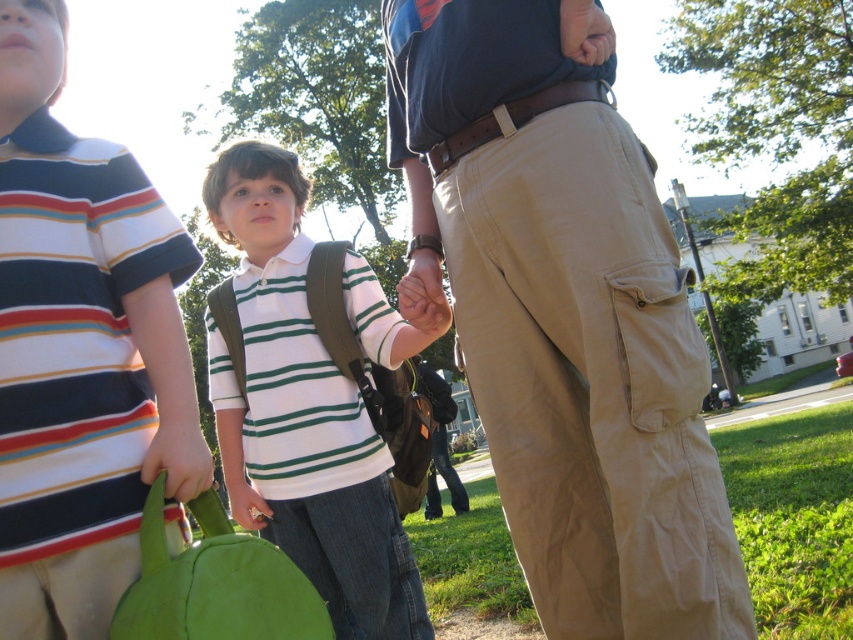
Question: Considering the relative positions of black leather jacket at lower center and matte green bag at lower left in the image provided, where is black leather jacket at lower center located with respect to matte green bag at lower left?

Choices:
 (A) below
 (B) above

Answer: (A)

Question: Which is nearer to the green fabric bag at lower left?

Choices:
 (A) matte green bag at lower left
 (B) striped cotton shirt at left
 (C) matte brown hand at center

Answer: (B)

Question: Does khaki pants at center have a greater width compared to striped cotton shirt at left?

Choices:
 (A) yes
 (B) no

Answer: (A)

Question: Which point is farther to the camera?

Choices:
 (A) (267, 522)
 (B) (265, 602)
 (C) (428, 256)
 (D) (314, 445)

Answer: (A)

Question: Considering the relative positions of white striped shirt at center and green fabric bag at lower left in the image provided, where is white striped shirt at center located with respect to green fabric bag at lower left?

Choices:
 (A) left
 (B) right

Answer: (B)

Question: Which of the following is the farthest from the observer?

Choices:
 (A) matte green bag at lower left
 (B) striped cotton shirt at left
 (C) khaki pants at center
 (D) matte brown hand at center

Answer: (A)